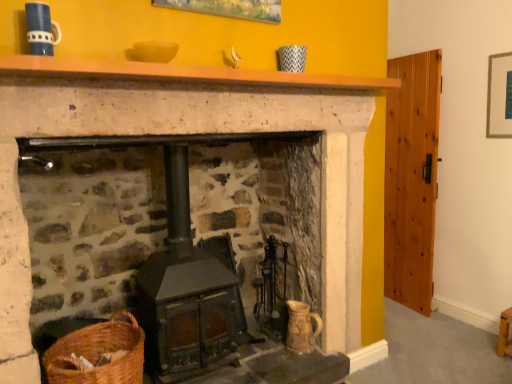
Locate an element on the screen. The width and height of the screenshot is (512, 384). unoccupied space behind wooden stool at lower right is located at coordinates (484, 332).